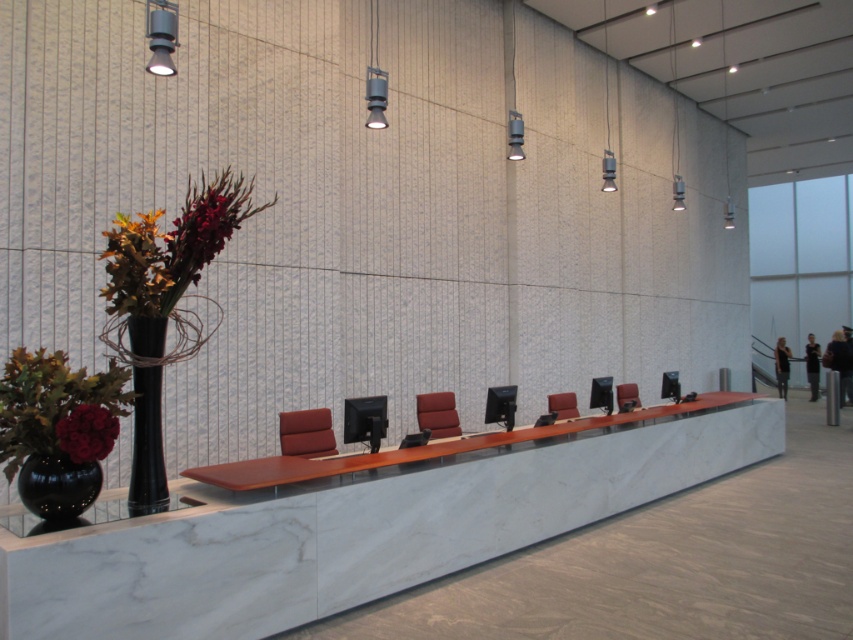
Who is lower down, black glossy vase at left or matte brown leather chair at center?

Positioned lower is matte brown leather chair at center.

Is point (151, 387) more distant than point (616, 392)?

No, (151, 387) is in front of (616, 392).

Is point (136, 340) farther from viewer compared to point (618, 392)?

No, (136, 340) is closer to viewer.

Locate an element on the screen. The image size is (853, 640). black glossy vase at left is located at coordinates (148, 444).

Between suede-like brown chair at center and matte red leather chair at center, which one appears on the right side from the viewer's perspective?

matte red leather chair at center is more to the right.

Which is in front, point (281, 435) or point (566, 396)?

Point (281, 435) is more forward.

Find the location of `suede-like brown chair at center`. suede-like brown chair at center is located at coordinates pyautogui.click(x=306, y=433).

Is point (28, 472) positioned after point (416, 417)?

That is False.

Which is below, black glossy vase at lower left or velvet maroon chair at center?

velvet maroon chair at center is lower down.

You are a GUI agent. You are given a task and a screenshot of the screen. Output one action in this format:
    pyautogui.click(x=<x>, y=<y>)
    Task: Click on the black glossy vase at lower left
    This screenshot has height=640, width=853.
    Given the screenshot: What is the action you would take?
    pyautogui.click(x=57, y=484)